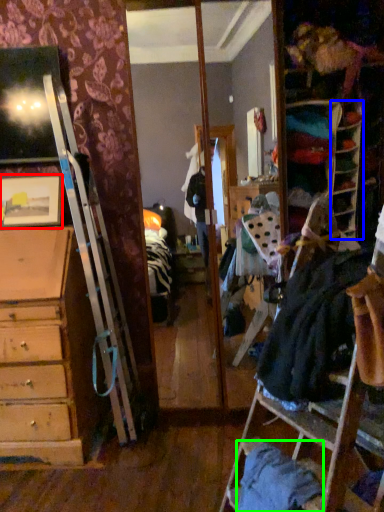
Question: Which is farther away from picture frame (highlighted by a red box)? shelf (highlighted by a blue box) or clothing (highlighted by a green box)?

Choices:
 (A) shelf
 (B) clothing

Answer: (B)